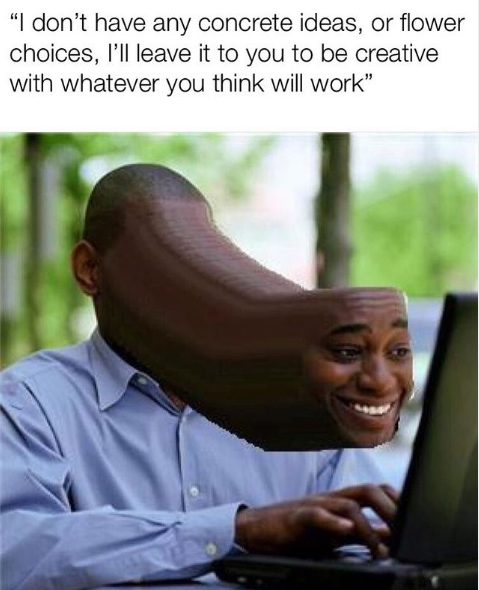
Where is `keyboard`? The height and width of the screenshot is (590, 479). keyboard is located at coordinates (355, 552).